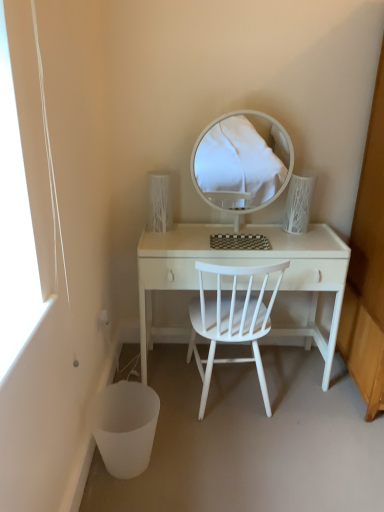
Question: Should I look upward or downward to see white matte chair at center?

Choices:
 (A) up
 (B) down

Answer: (B)

Question: Is white matte chair at center facing away from white wood desk at center?

Choices:
 (A) yes
 (B) no

Answer: (A)

Question: Could you tell me if white matte chair at center is turned towards white wood desk at center?

Choices:
 (A) yes
 (B) no

Answer: (A)

Question: Considering the relative sizes of white matte chair at center and white wood desk at center in the image provided, is white matte chair at center wider than white wood desk at center?

Choices:
 (A) yes
 (B) no

Answer: (A)

Question: Considering the relative sizes of white matte chair at center and white wood desk at center in the image provided, is white matte chair at center shorter than white wood desk at center?

Choices:
 (A) yes
 (B) no

Answer: (B)

Question: Is white wood desk at center located within white matte chair at center?

Choices:
 (A) yes
 (B) no

Answer: (B)

Question: Can you confirm if white matte chair at center is positioned to the left of white wood desk at center?

Choices:
 (A) no
 (B) yes

Answer: (B)

Question: Can you confirm if white glossy mirror at center is positioned to the left of white matte chair at center?

Choices:
 (A) no
 (B) yes

Answer: (A)

Question: Is white glossy mirror at center facing away from white matte chair at center?

Choices:
 (A) no
 (B) yes

Answer: (A)

Question: Can you confirm if white glossy mirror at center is wider than white matte chair at center?

Choices:
 (A) no
 (B) yes

Answer: (A)

Question: Is white glossy mirror at center further to camera compared to white matte chair at center?

Choices:
 (A) yes
 (B) no

Answer: (A)

Question: Does white glossy mirror at center turn towards white matte chair at center?

Choices:
 (A) yes
 (B) no

Answer: (B)

Question: Does white glossy mirror at center have a larger size compared to white matte chair at center?

Choices:
 (A) no
 (B) yes

Answer: (A)

Question: Is white matte chair at center wider than white glossy mirror at center?

Choices:
 (A) no
 (B) yes

Answer: (B)